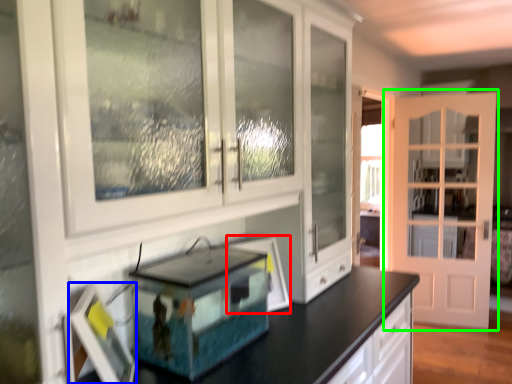
Question: Based on their relative distances, which object is farther from picture frame (highlighted by a red box)? Choose from picture frame (highlighted by a blue box) and door (highlighted by a green box).

Choices:
 (A) picture frame
 (B) door

Answer: (B)